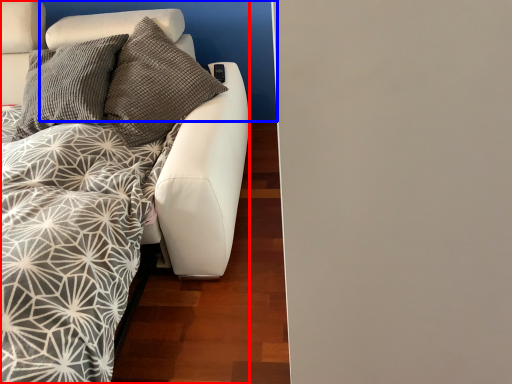
Question: Which object is closer to the camera taking this photo, furniture (highlighted by a red box) or backdrop (highlighted by a blue box)?

Choices:
 (A) furniture
 (B) backdrop

Answer: (A)